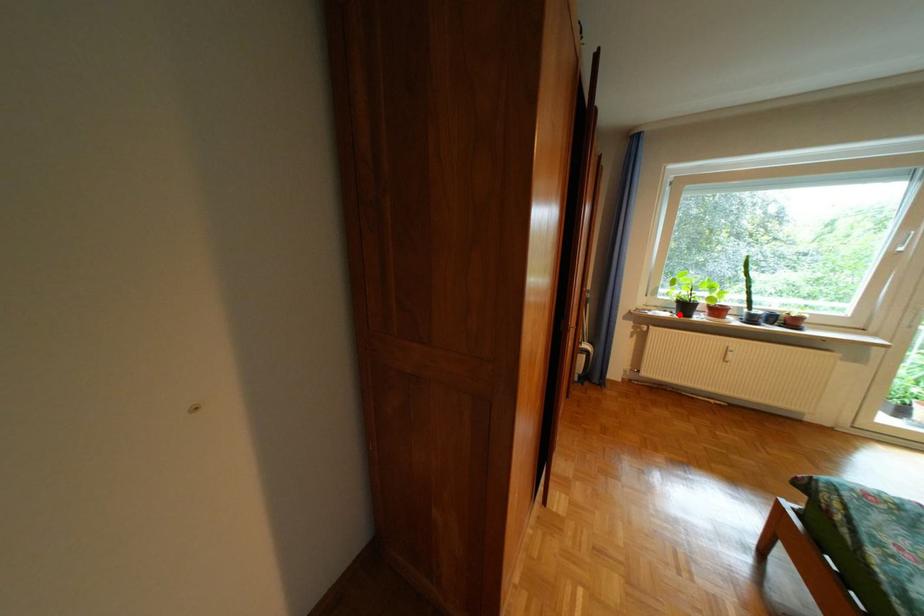
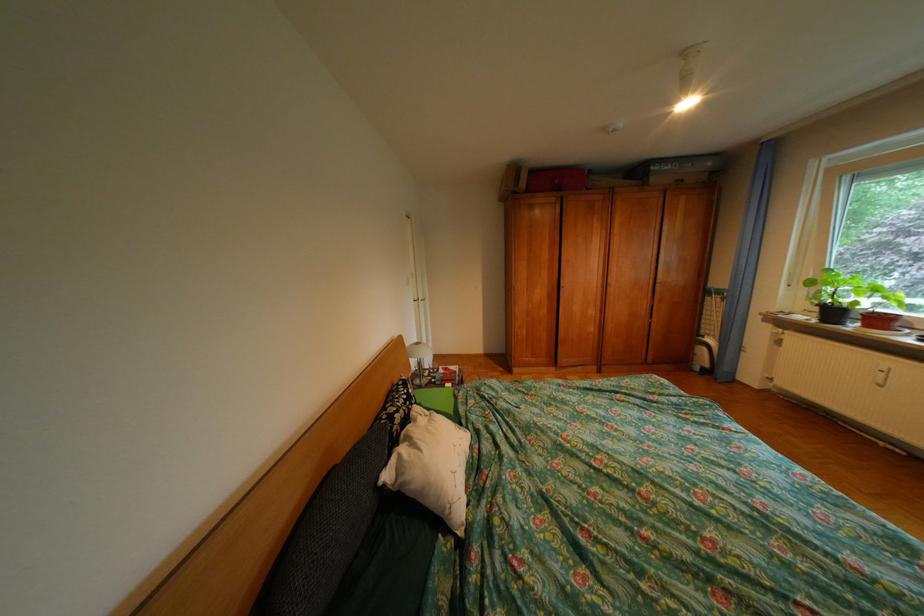
In the second image, find the point that corresponds to the highlighted location in the first image.

(819, 318)